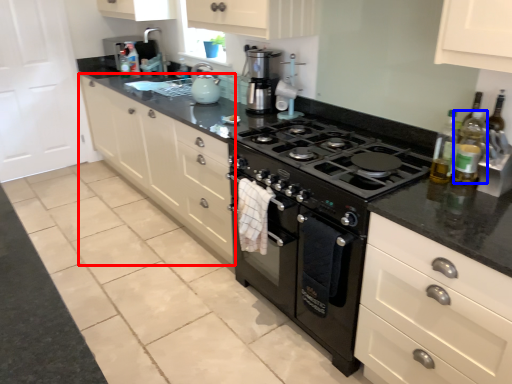
Question: Which point is closer to the camera, cabinetry (highlighted by a red box) or bottle (highlighted by a blue box)?

Choices:
 (A) cabinetry
 (B) bottle

Answer: (B)